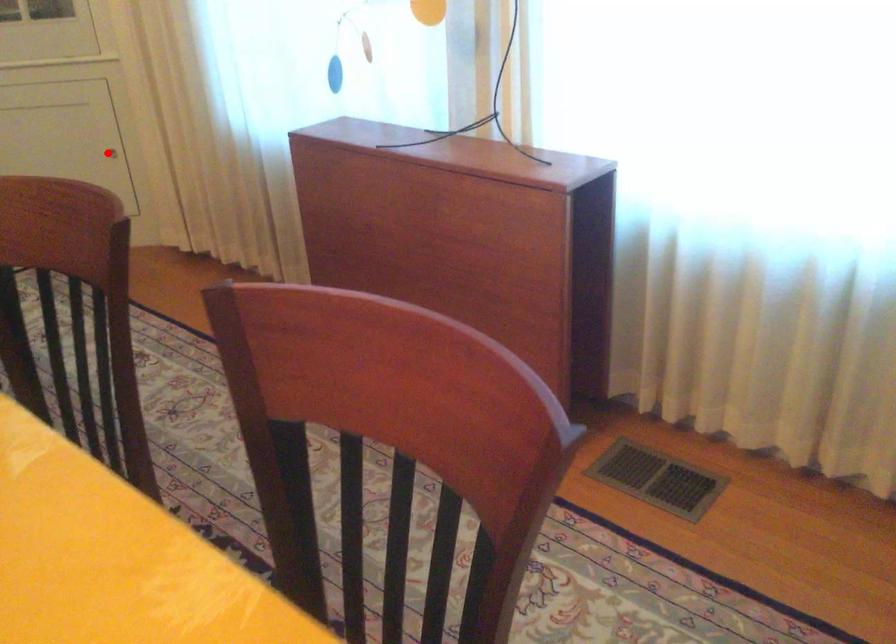
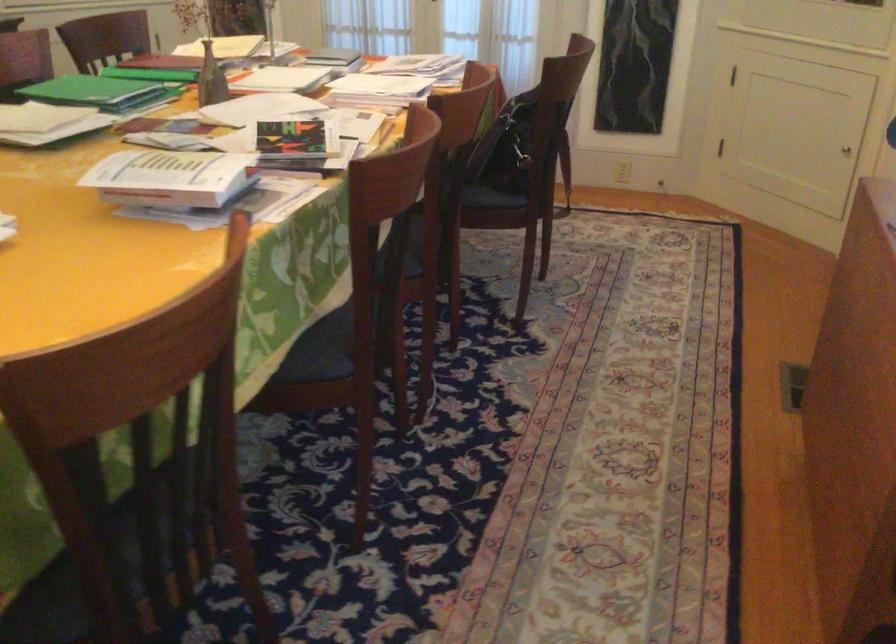
Locate, in the second image, the point that corresponds to the highlighted location in the first image.

(846, 149)